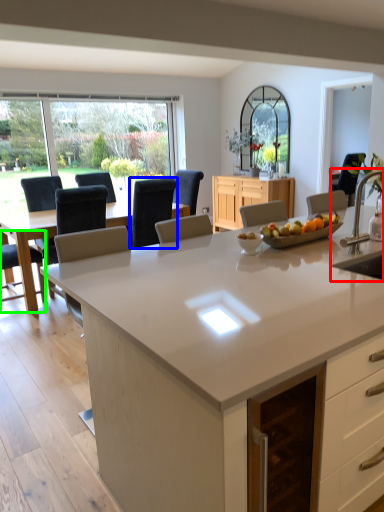
Question: Which object is the closest to the sink (highlighted by a red box)? Choose among these: chair (highlighted by a blue box) or chair (highlighted by a green box).

Choices:
 (A) chair
 (B) chair

Answer: (A)